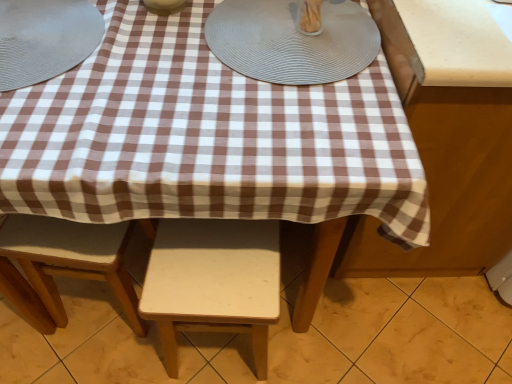
Image resolution: width=512 pixels, height=384 pixels. What are the coordinates of `free space in front of light wood stool at lower center, the 1th stool positioned from the left` in the screenshot? It's located at (93, 359).